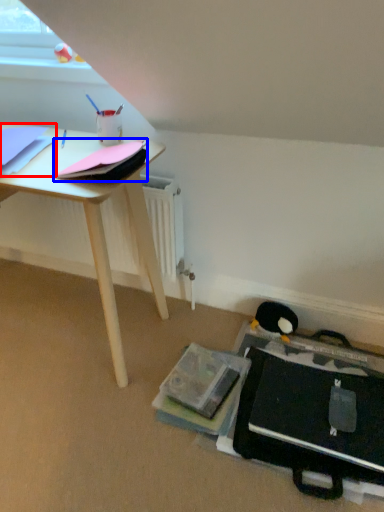
Question: Which point is further to the camera, paperback book (highlighted by a red box) or paperback book (highlighted by a blue box)?

Choices:
 (A) paperback book
 (B) paperback book

Answer: (A)